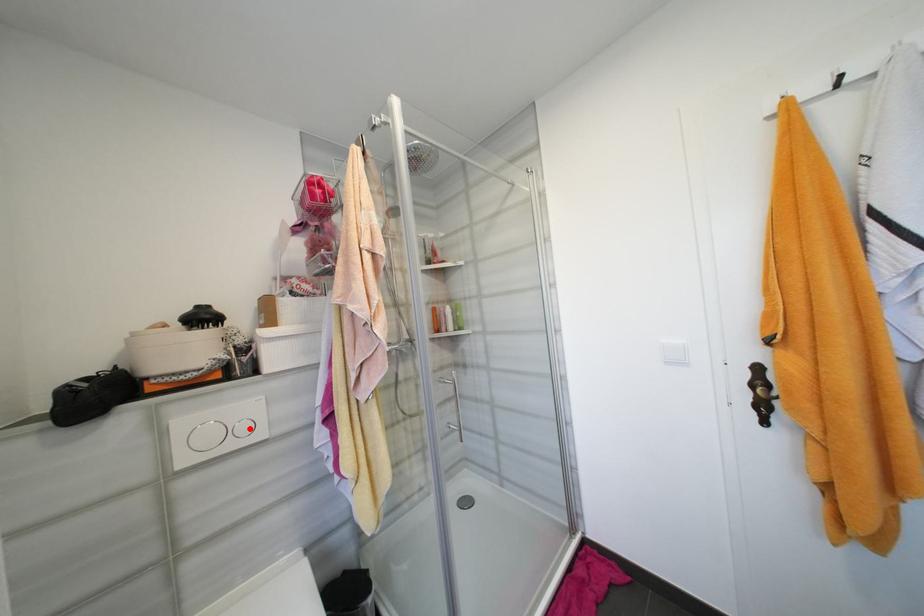
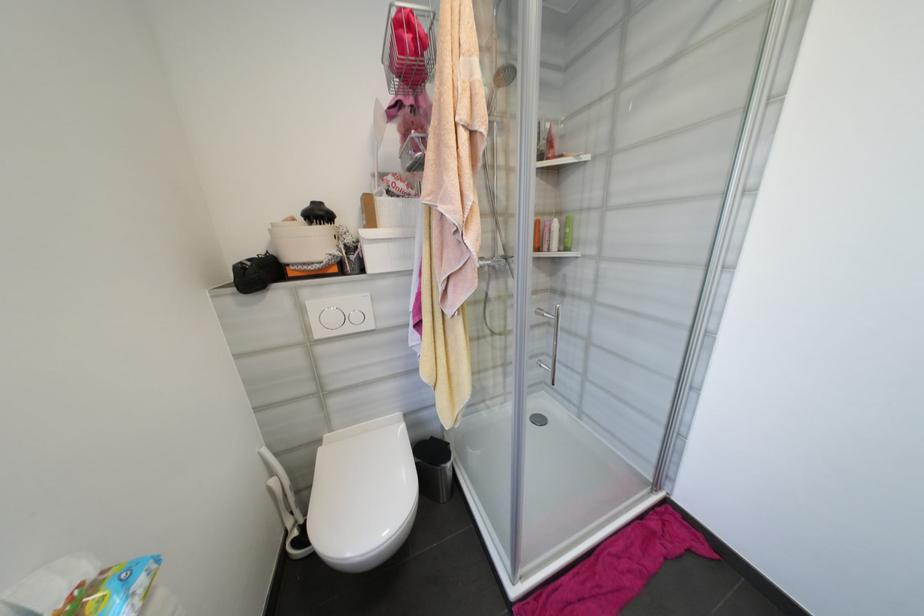
In the second image, find the point that corresponds to the highlighted location in the first image.

(361, 318)